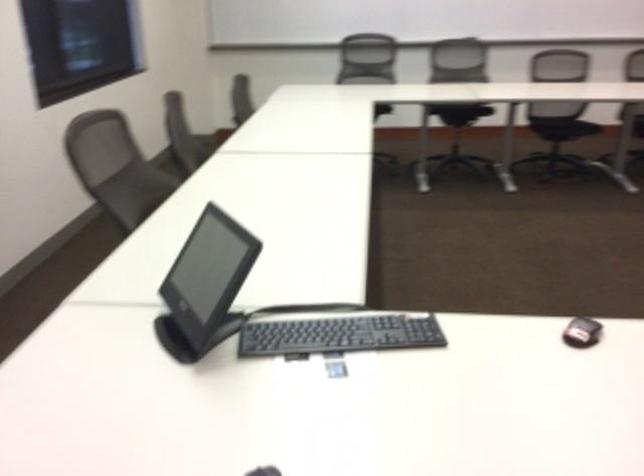
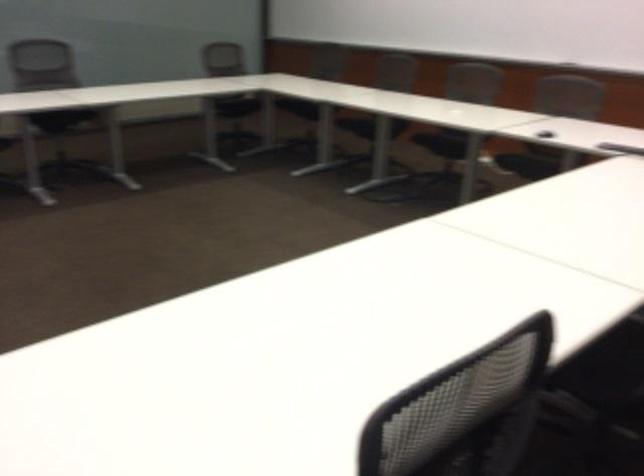
Question: In a continuous first-person perspective shot, in which direction is the camera moving?

Choices:
 (A) Left
 (B) Right
 (C) Forward
 (D) Backward

Answer: (D)